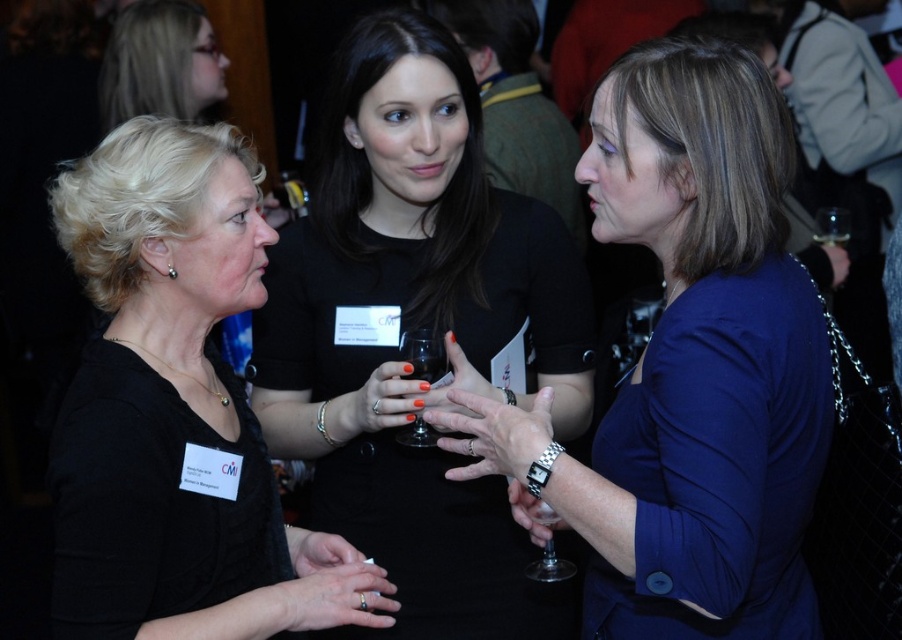
Can you confirm if black matte shirt at left is positioned below transparent glass at center?

No.

Can you confirm if black matte shirt at left is positioned to the left of transparent glass at center?

Indeed, black matte shirt at left is positioned on the left side of transparent glass at center.

Does point (161, 536) come closer to viewer compared to point (539, 509)?

That is True.

At what (x,y) coordinates should I click in order to perform the action: click on black matte shirt at left. Please return your answer as a coordinate pair (x, y). This screenshot has width=902, height=640. Looking at the image, I should click on (175, 410).

Can you confirm if blue fabric jacket at center is bigger than blonde hair at upper left?

Yes, blue fabric jacket at center is bigger than blonde hair at upper left.

Who is positioned more to the right, blue fabric jacket at center or blonde hair at upper left?

Positioned to the right is blue fabric jacket at center.

Image resolution: width=902 pixels, height=640 pixels. I want to click on blue fabric jacket at center, so click(x=691, y=365).

The image size is (902, 640). I want to click on blue fabric jacket at center, so click(x=691, y=365).

Does black matte shirt at left appear on the left side of transparent glass at right?

Indeed, black matte shirt at left is positioned on the left side of transparent glass at right.

Between black matte shirt at left and transparent glass at right, which one appears on the left side from the viewer's perspective?

black matte shirt at left is more to the left.

Which is behind, point (107, 422) or point (840, 209)?

The point (840, 209) is more distant.

The width and height of the screenshot is (902, 640). Identify the location of black matte shirt at left. (175, 410).